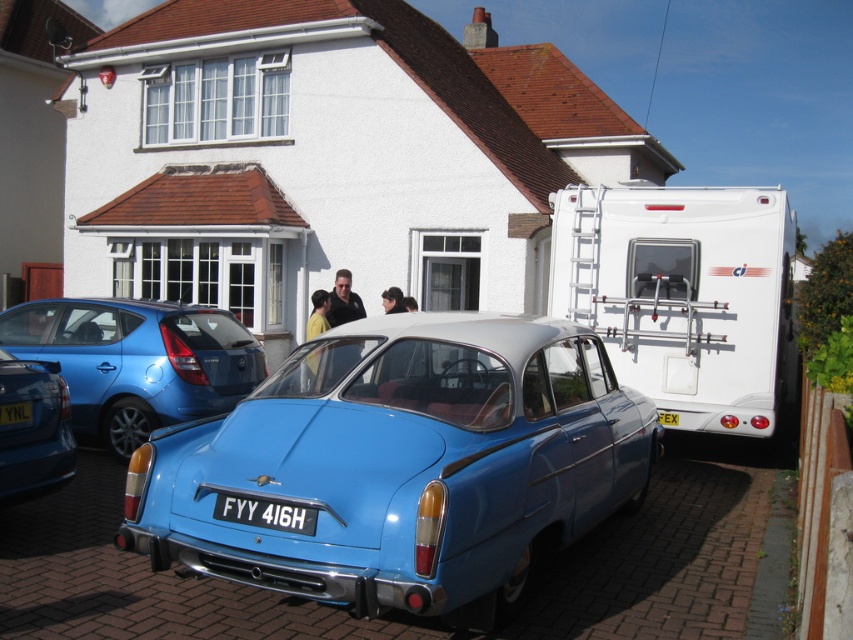
Question: Which object appears farthest from the camera in this image?

Choices:
 (A) matte blue sedan at left
 (B) blue matte car at center
 (C) blue metallic license plate at center

Answer: (A)

Question: Which of these objects is positioned closest to the yellow matte license plate at lower left?

Choices:
 (A) matte blue car at left
 (B) blue metallic license plate at center
 (C) yellowmaterial/texturelicense plate at center

Answer: (A)

Question: Does blue metallic license plate at center have a smaller size compared to yellow matte license plate at lower left?

Choices:
 (A) no
 (B) yes

Answer: (A)

Question: Is blue metallic license plate at center bigger than yellowmaterial/texturelicense plate at center?

Choices:
 (A) yes
 (B) no

Answer: (A)

Question: Which object appears farthest from the camera in this image?

Choices:
 (A) matte blue sedan at left
 (B) yellowmaterial/texturelicense plate at center

Answer: (B)

Question: Can you confirm if blue metallic license plate at center is positioned above yellowmaterial/texturelicense plate at center?

Choices:
 (A) yes
 (B) no

Answer: (A)